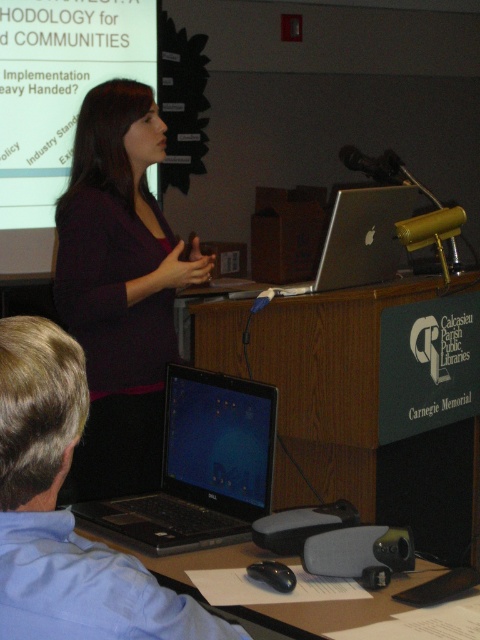
Is white matte projection screen at upper left thinner than blue glossy laptop at center?

In fact, white matte projection screen at upper left might be wider than blue glossy laptop at center.

Does white matte projection screen at upper left have a larger size compared to blue glossy laptop at center?

Yes, white matte projection screen at upper left is bigger than blue glossy laptop at center.

Describe the element at coordinates (57, 102) in the screenshot. The image size is (480, 640). I see `white matte projection screen at upper left` at that location.

At what (x,y) coordinates should I click in order to perform the action: click on white matte projection screen at upper left. Please return your answer as a coordinate pair (x, y). Looking at the image, I should click on (57, 102).

Is point (478, 545) farther from viewer compared to point (26, 563)?

That is True.

Between black plastic table at center and black matte laptop at lower left, which one is positioned lower?

black plastic table at center is lower down.

Which is behind, point (382, 284) or point (28, 429)?

The point (382, 284) is behind.

Locate an element on the screen. black plastic table at center is located at coordinates (348, 410).

Between point (93, 618) and point (268, 410), which one is positioned in front?

Point (93, 618)

Is point (28, 456) positioned in front of point (197, 445)?

Yes, it is.

Who is more forward, (3, 525) or (215, 388)?

Point (3, 525)

You are a GUI agent. You are given a task and a screenshot of the screen. Output one action in this format:
    pyautogui.click(x=<x>, y=<y>)
    Task: Click on the black matte laptop at lower left
    
    Given the screenshot: What is the action you would take?
    pyautogui.click(x=66, y=513)